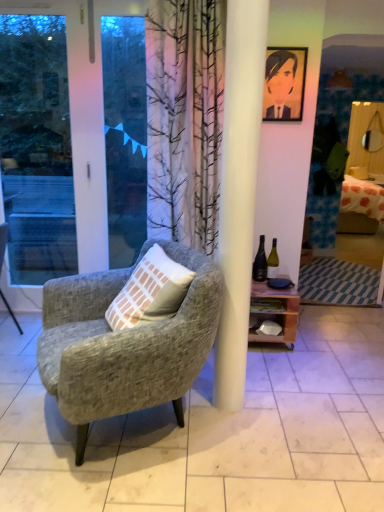
Question: Is textured gray armchair at center, acting as the first chair starting from the right, surrounding white glass bottle at right, which ranks as the first bottle in right-to-left order?

Choices:
 (A) no
 (B) yes

Answer: (A)

Question: From the image's perspective, is textured gray armchair at center, the 2th chair in the left-to-right sequence, located beneath white glass bottle at right, the 2th bottle from the left?

Choices:
 (A) yes
 (B) no

Answer: (A)

Question: Considering the relative sizes of textured gray armchair at center, acting as the first chair starting from the right, and white glass bottle at right, which ranks as the first bottle in right-to-left order, in the image provided, is textured gray armchair at center, acting as the first chair starting from the right, smaller than white glass bottle at right, which ranks as the first bottle in right-to-left order,?

Choices:
 (A) yes
 (B) no

Answer: (B)

Question: Considering the relative positions of textured gray armchair at center, acting as the first chair starting from the right, and white glass bottle at right, which ranks as the first bottle in right-to-left order, in the image provided, is textured gray armchair at center, acting as the first chair starting from the right, to the right of white glass bottle at right, which ranks as the first bottle in right-to-left order, from the viewer's perspective?

Choices:
 (A) yes
 (B) no

Answer: (B)

Question: From the image's perspective, is textured gray armchair at center, acting as the first chair starting from the right, located above white glass bottle at right, which ranks as the first bottle in right-to-left order?

Choices:
 (A) yes
 (B) no

Answer: (B)

Question: Is point (266, 261) positioned closer to the camera than point (109, 69)?

Choices:
 (A) closer
 (B) farther

Answer: (B)

Question: From their relative heights in the image, would you say green glass bottle at center-right, which is the second bottle from right to left, is taller or shorter than transparent glass door at left?

Choices:
 (A) short
 (B) tall

Answer: (A)

Question: In terms of width, does green glass bottle at center-right, which is the second bottle from right to left, look wider or thinner when compared to transparent glass door at left?

Choices:
 (A) thin
 (B) wide

Answer: (B)

Question: Considering their positions, is green glass bottle at center-right, the first bottle from the left, located in front of or behind transparent glass door at left?

Choices:
 (A) behind
 (B) front

Answer: (A)

Question: Based on their sizes in the image, would you say transparent glass door at left is bigger or smaller than wooden at right?

Choices:
 (A) big
 (B) small

Answer: (A)

Question: Is transparent glass door at left taller or shorter than wooden at right?

Choices:
 (A) tall
 (B) short

Answer: (A)

Question: In the image, is transparent glass door at left on the left side or the right side of wooden at right?

Choices:
 (A) right
 (B) left

Answer: (B)

Question: Is transparent glass door at left inside or outside of wooden at right?

Choices:
 (A) inside
 (B) outside

Answer: (B)

Question: From the image's perspective, is textured gray armchair at center, acting as the first chair starting from the right, positioned above or below wooden at right?

Choices:
 (A) above
 (B) below

Answer: (B)

Question: Considering the positions of point (158, 365) and point (292, 297), is point (158, 365) closer or farther from the camera than point (292, 297)?

Choices:
 (A) closer
 (B) farther

Answer: (A)